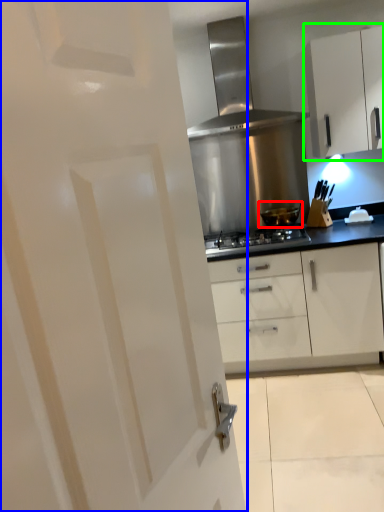
Question: Based on their relative distances, which object is nearer to kitchen appliance (highlighted by a red box)? Choose from door (highlighted by a blue box) and cabinetry (highlighted by a green box).

Choices:
 (A) door
 (B) cabinetry

Answer: (B)